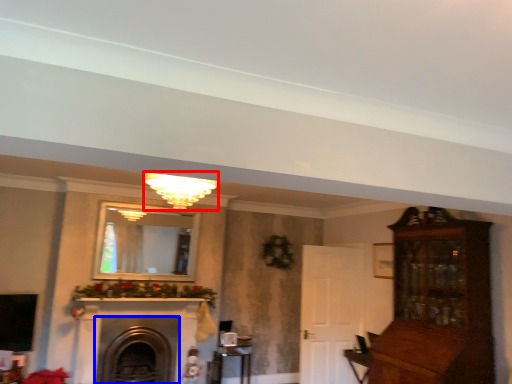
Question: Among these objects, which one is nearest to the camera, light fixture (highlighted by a red box) or fireplace (highlighted by a blue box)?

Choices:
 (A) light fixture
 (B) fireplace

Answer: (A)